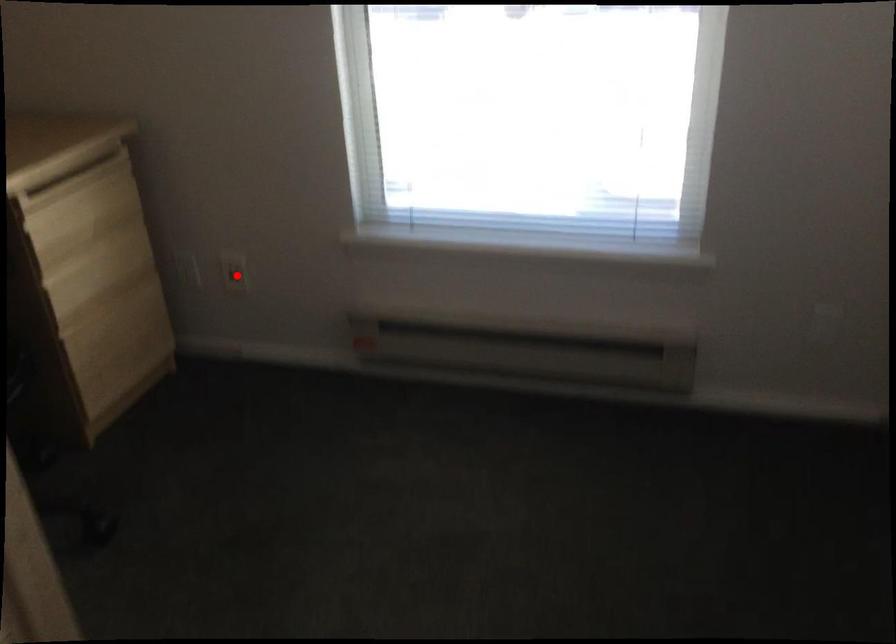
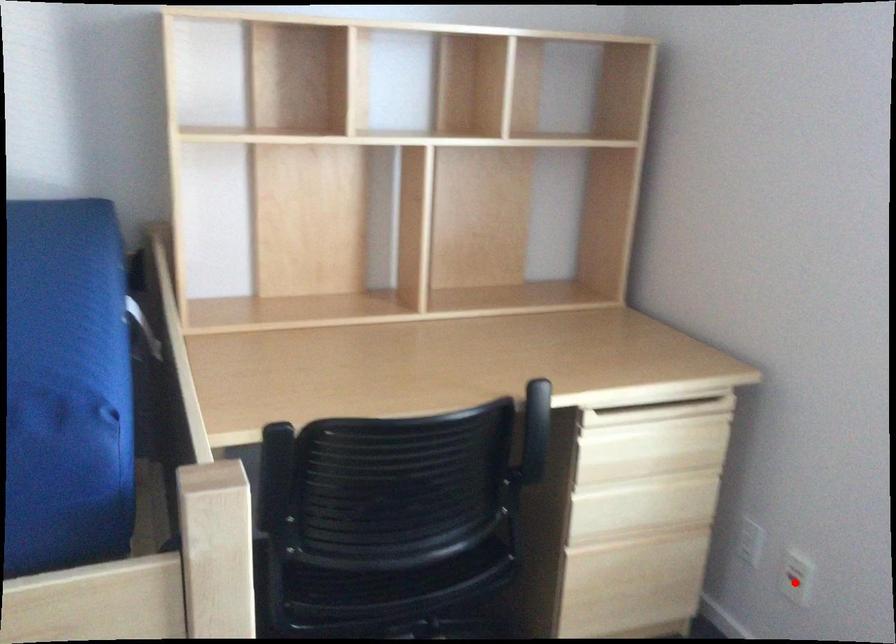
In the scene shown: I am providing you with two images of the same scene from different viewpoints. A red point is marked on the first image and another point is marked on the second image. Is the marked point in image1 the same physical position as the marked point in image2?

Yes